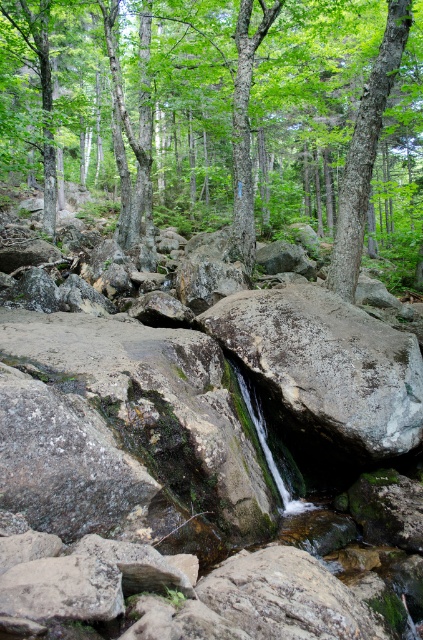
Is green mossy rock at center below green leafy tree at center?

Yes, green mossy rock at center is below green leafy tree at center.

Is green mossy rock at center bigger than green leafy tree at center?

Actually, green mossy rock at center might be smaller than green leafy tree at center.

Who is more distant from viewer, (173, 385) or (200, 108)?

The point (200, 108) is more distant.

The height and width of the screenshot is (640, 423). Identify the location of green mossy rock at center. (120, 456).

Consider the image. Can you confirm if gray rough rock at center is taller than smooth bark tree at upper center?

Correct, gray rough rock at center is much taller as smooth bark tree at upper center.

Measure the distance between gray rough rock at center and camera.

gray rough rock at center is 5.75 meters from camera.

At what (x,y) coordinates should I click in order to perform the action: click on gray rough rock at center. Please return your answer as a coordinate pair (x, y). This screenshot has height=640, width=423. Looking at the image, I should click on (326, 368).

Measure the distance from green leafy tree at center to gray rough rock at center.

The distance of green leafy tree at center from gray rough rock at center is 52.62 feet.

Is green leafy tree at center positioned at the back of gray rough rock at center?

That is True.

Locate an element on the screen. green leafy tree at center is located at coordinates (225, 115).